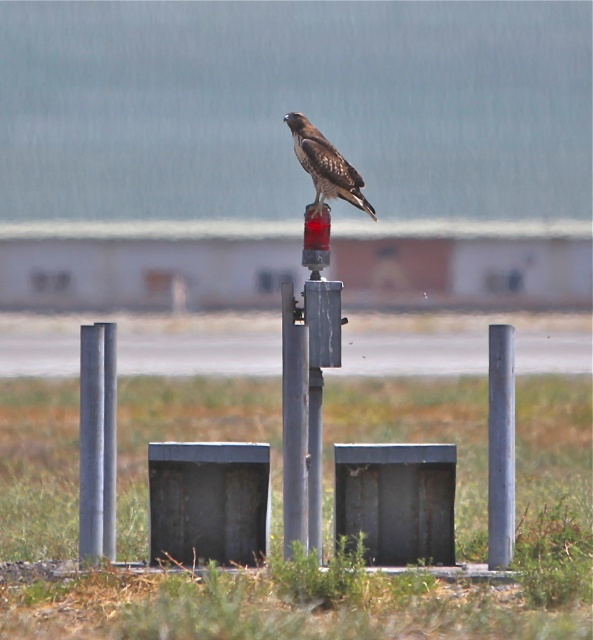
You are a birdwatcher observing the scene. You notice the metallic gray post at left and the brown speckled feathers at center. Which object is positioned lower in the image?

The metallic gray post at left is located below brown speckled feathers at center, so the metallic gray post at left is positioned lower in the image.

You are standing at the base of the metallic gray post at left and want to take a photo of the hawk on the red light fixture. If your camera has a maximum range of 10 meters, will you be able to capture the hawk in your photo?

The metallic gray post at left and camera are 10.55 meters apart. Since the camera has a maximum range of 10 meters, you will not be able to capture the hawk in your photo as the distance exceeds the camera range.